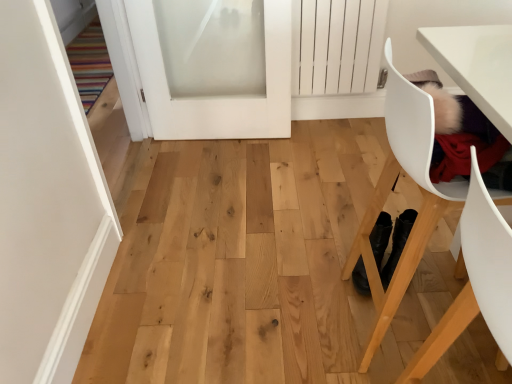
Question: Can you confirm if white matte door at upper left, the first door positioned from the left, is bigger than white plastic chair at right, marked as the 2th chair in a front-to-back arrangement?

Choices:
 (A) no
 (B) yes

Answer: (B)

Question: Considering the relative positions of white matte door at upper left, the 2th door from the right, and white plastic chair at right, marked as the 2th chair in a front-to-back arrangement, in the image provided, is white matte door at upper left, the 2th door from the right, to the left of white plastic chair at right, marked as the 2th chair in a front-to-back arrangement, from the viewer's perspective?

Choices:
 (A) no
 (B) yes

Answer: (B)

Question: Is white matte door at upper left, the first door positioned from the left, positioned beyond the bounds of white plastic chair at right, marked as the 2th chair in a front-to-back arrangement?

Choices:
 (A) no
 (B) yes

Answer: (B)

Question: Does white matte door at upper left, the 2th door from the right, turn towards white plastic chair at right, marked as the 2th chair in a front-to-back arrangement?

Choices:
 (A) no
 (B) yes

Answer: (B)

Question: From a real-world perspective, is white matte door at upper left, the first door positioned from the left, over white plastic chair at right, the 1th chair positioned from the back?

Choices:
 (A) no
 (B) yes

Answer: (B)

Question: Considering their positions, is white frosted glass door at upper center, the second door positioned from the left, located in front of or behind white plastic chair at lower right, the second chair in the back-to-front sequence?

Choices:
 (A) behind
 (B) front

Answer: (A)

Question: In terms of height, does white frosted glass door at upper center, acting as the first door starting from the right, look taller or shorter compared to white plastic chair at lower right, the second chair in the back-to-front sequence?

Choices:
 (A) tall
 (B) short

Answer: (B)

Question: Considering the positions of white frosted glass door at upper center, acting as the first door starting from the right, and white plastic chair at lower right, the second chair in the back-to-front sequence, in the image, is white frosted glass door at upper center, acting as the first door starting from the right, bigger or smaller than white plastic chair at lower right, the second chair in the back-to-front sequence,?

Choices:
 (A) big
 (B) small

Answer: (A)

Question: Is white frosted glass door at upper center, the second door positioned from the left, inside the boundaries of white plastic chair at lower right, the second chair in the back-to-front sequence, or outside?

Choices:
 (A) outside
 (B) inside

Answer: (A)

Question: Considering their positions, is white plastic chair at right, the 1th chair positioned from the back, located in front of or behind white plastic chair at lower right, the second chair in the back-to-front sequence?

Choices:
 (A) front
 (B) behind

Answer: (B)

Question: Is white plastic chair at right, the 1th chair positioned from the back, bigger or smaller than white plastic chair at lower right, the second chair in the back-to-front sequence?

Choices:
 (A) small
 (B) big

Answer: (B)

Question: Is white plastic chair at right, marked as the 2th chair in a front-to-back arrangement, spatially inside white plastic chair at lower right, the second chair in the back-to-front sequence, or outside of it?

Choices:
 (A) inside
 (B) outside

Answer: (B)

Question: From the image's perspective, is white plastic chair at right, the 1th chair positioned from the back, located above or below white plastic chair at lower right, the second chair in the back-to-front sequence?

Choices:
 (A) above
 (B) below

Answer: (A)

Question: Considering the relative positions of white matte door at upper left, the 2th door from the right, and white frosted glass door at upper center, acting as the first door starting from the right, in the image provided, is white matte door at upper left, the 2th door from the right, to the left or to the right of white frosted glass door at upper center, acting as the first door starting from the right,?

Choices:
 (A) right
 (B) left

Answer: (B)

Question: Would you say white matte door at upper left, the first door positioned from the left, is inside or outside white frosted glass door at upper center, acting as the first door starting from the right?

Choices:
 (A) inside
 (B) outside

Answer: (B)